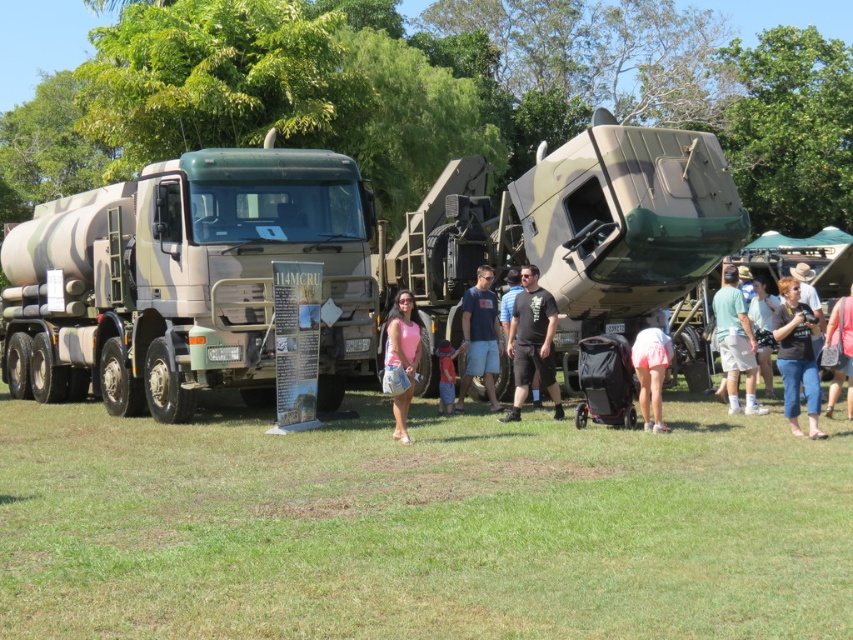
Consider the image. You are standing at the point labeled as point (x=784, y=378). You want to walk towards the truck that has a cylindrical tank on its back. Which direction should you go relative to the other point labeled point (x=631, y=353)?

Since point (x=784, y=378) is in front of point (x=631, y=353), you should walk towards the truck with the cylindrical tank on its back by moving away from point (x=631, y=353).

From the picture: You are standing at the entrance of the event and see two people wearing blue jeans at lower right and pink fabric shorts at lower right. You need to deliver a pamphlet to the person who is closer to you. Which person should you give it to?

The blue jeans at lower right is 1.31 meters away from pink fabric shorts at lower right. Since the blue jeans at lower right is closer to you, you should give the pamphlet to the person wearing blue jeans at lower right.

You are standing at the point marked by the coordinates point (463, 300). You want to walk to the nearest military truck displayed in the background. Which truck should you go to?

The point marked by the coordinates point (463, 300) is 42.07 feet away from the viewer. Since the nearest military truck would be the one closest to the point, but the description only provides the distance from the point to the viewer, not to the trucks, we cannot determine which truck is closer based on the given information.